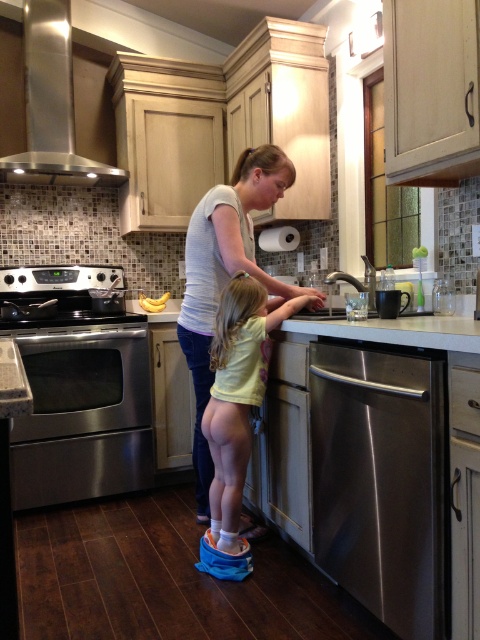
Measure the distance between yellow matte shirt at center and yellow matte bananas at center.

yellow matte shirt at center and yellow matte bananas at center are 4.46 feet apart.

Between yellow matte shirt at center and yellow matte bananas at center, which one is positioned lower?

yellow matte shirt at center is lower down.

Describe the element at coordinates (238, 400) in the screenshot. This screenshot has height=640, width=480. I see `yellow matte shirt at center` at that location.

You are a GUI agent. You are given a task and a screenshot of the screen. Output one action in this format:
    pyautogui.click(x=<x>, y=<y>)
    Task: Click on the yellow matte shirt at center
    This screenshot has width=480, height=640.
    Given the screenshot: What is the action you would take?
    pyautogui.click(x=238, y=400)

Does stainless steel oven at lower left have a lesser width compared to white glossy counter top at center?

Correct, stainless steel oven at lower left's width is less than white glossy counter top at center's.

Does stainless steel oven at lower left come in front of white glossy counter top at center?

No, it is behind white glossy counter top at center.

Is point (73, 481) positioned before point (389, 321)?

No, (73, 481) is further to viewer.

At what (x,y) coordinates should I click in order to perform the action: click on stainless steel oven at lower left. Please return your answer as a coordinate pair (x, y). Looking at the image, I should click on (83, 413).

Based on the photo, which of these two, stainless steel oven at lower left or yellow matte bananas at center, stands shorter?

yellow matte bananas at center

Does stainless steel oven at lower left appear on the right side of yellow matte bananas at center?

No, stainless steel oven at lower left is not to the right of yellow matte bananas at center.

The height and width of the screenshot is (640, 480). What are the coordinates of `stainless steel oven at lower left` in the screenshot? It's located at (83, 413).